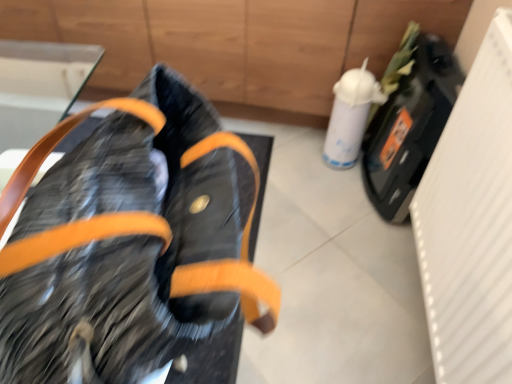
You are a GUI agent. You are given a task and a screenshot of the screen. Output one action in this format:
    pyautogui.click(x=<x>, y=<y>)
    Task: Click on the leather bag at left
    Image resolution: width=512 pixels, height=384 pixels.
    Given the screenshot: What is the action you would take?
    pos(126,244)

What is the approximate width of leather bag at left?

It is 21.59 inches.

Image resolution: width=512 pixels, height=384 pixels. What do you see at coordinates (126, 244) in the screenshot? I see `leather bag at left` at bounding box center [126, 244].

At what (x,y) coordinates should I click in order to perform the action: click on leather bag at left. Please return your answer as a coordinate pair (x, y). Looking at the image, I should click on (126, 244).